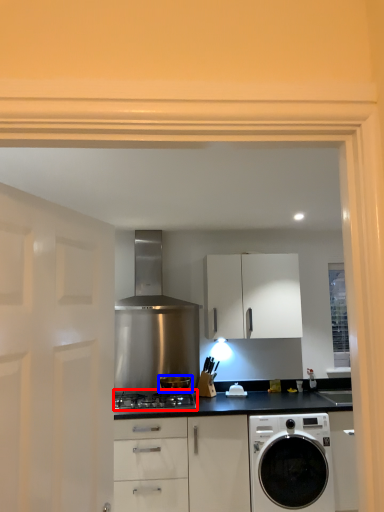
Question: Which point is further to the camera, gas stove (highlighted by a red box) or kitchen appliance (highlighted by a blue box)?

Choices:
 (A) gas stove
 (B) kitchen appliance

Answer: (B)